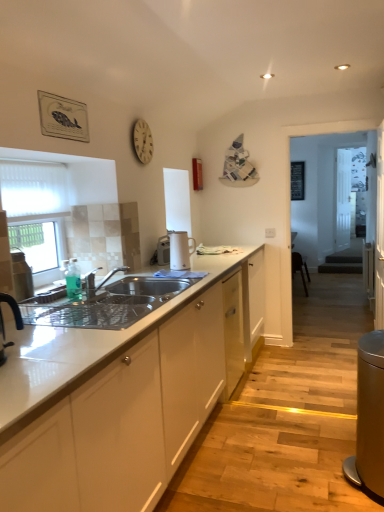
Find the location of a particular element. The height and width of the screenshot is (512, 384). vacant location behind metallic trash can at right, the first appliance when ordered from bottom to top is located at coordinates (322, 439).